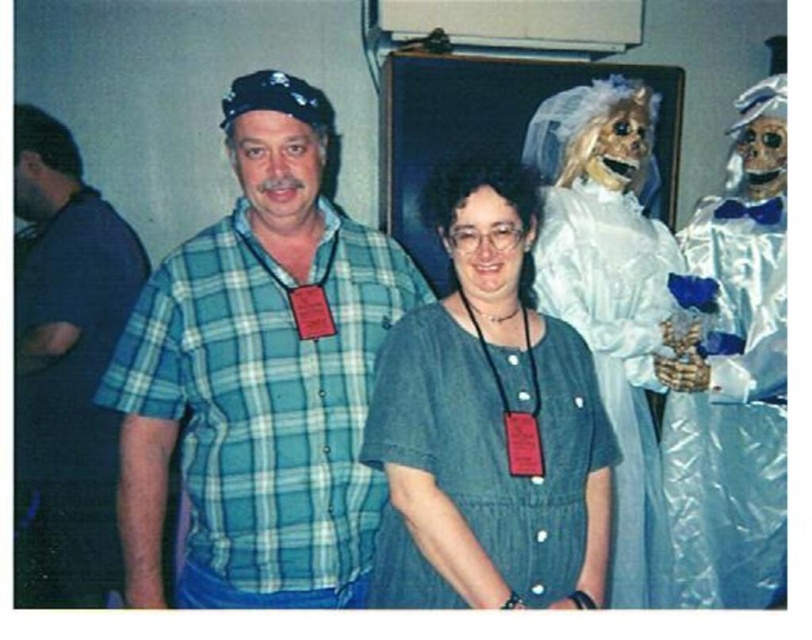
From the picture: Can you confirm if green plaid shirt at center is positioned to the right of denim shirt at center?

Incorrect, green plaid shirt at center is not on the right side of denim shirt at center.

Is green plaid shirt at center above denim shirt at center?

Yes.

At what (x,y) coordinates should I click in order to perform the action: click on green plaid shirt at center. Please return your answer as a coordinate pair (x, y). Looking at the image, I should click on (260, 376).

Can you confirm if denim shirt at center is positioned to the left of shiny silver suit at right?

Indeed, denim shirt at center is positioned on the left side of shiny silver suit at right.

Can you confirm if denim shirt at center is taller than shiny silver suit at right?

No.

The image size is (812, 640). In order to click on denim shirt at center in this screenshot , I will do `click(487, 424)`.

You are a GUI agent. You are given a task and a screenshot of the screen. Output one action in this format:
    pyautogui.click(x=<x>, y=<y>)
    Task: Click on the denim shirt at center
    Image resolution: width=812 pixels, height=640 pixels.
    Given the screenshot: What is the action you would take?
    pyautogui.click(x=487, y=424)

Who is more forward, [406,358] or [134,284]?

Positioned in front is point [406,358].

Can you confirm if denim shirt at center is positioned to the right of dark blue kilt at left?

Indeed, denim shirt at center is positioned on the right side of dark blue kilt at left.

I want to click on denim shirt at center, so click(487, 424).